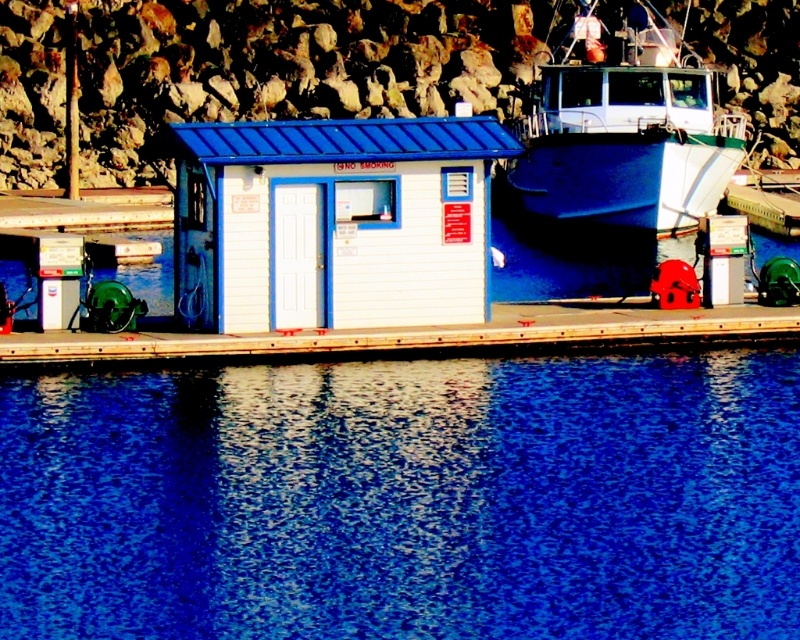
You are standing on the dock and looking at two points marked in the image. Which point, point (x=374, y=480) or point (x=616, y=161), is closer to you?

Point (x=374, y=480) is closer to you than point (x=616, y=161).

You are standing on the dock and want to pour water from the blue liquid water at lower center into a container located near the white matte hut at center. Can you do this without moving the container?

The blue liquid water at lower center is closer to the viewer than the white matte hut at center, so you can pour water from the blue liquid water at lower center into the container near the white matte hut at center without moving the container because the water is already in front of the hut.